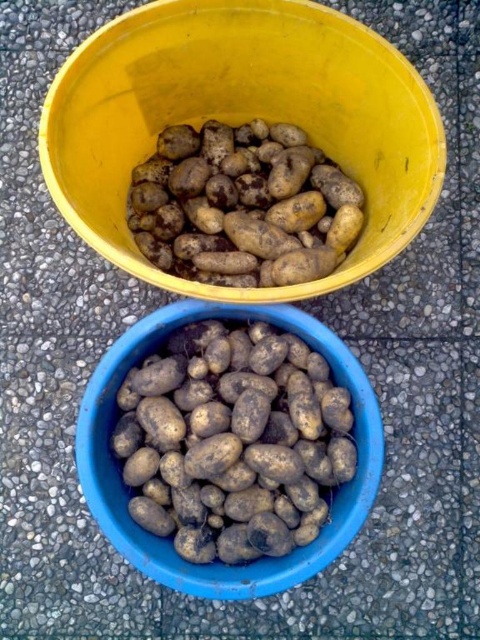
You are a delivery robot with a 5 inch wide arm. You need to place a potato from the brown matte potatoes at upper center into the yellow plastic bucket at upper center. Can your arm fit between them without touching either?

The yellow plastic bucket at upper center is 4.84 inches away from the brown matte potatoes at upper center. Since your arm is 5 inches wide, it is slightly wider than the space between them, so it might not fit without touching either object.

You are a farmer who needs to place a 12 inch ruler between the smooth brown potato at bottom center and the brown matte potatoes at upper center. Can you fit the ruler between them without bending it?

The distance between the smooth brown potato at bottom center and the brown matte potatoes at upper center is 12.73 inches, so yes, the ruler can fit between them since it is longer than the required space.

You are a farmer who wants to check the height of the yellow plastic bucket at upper center and the brown matte potatoes at upper center. Which one is taller?

The yellow plastic bucket at upper center is taller than brown matte potatoes at upper center.